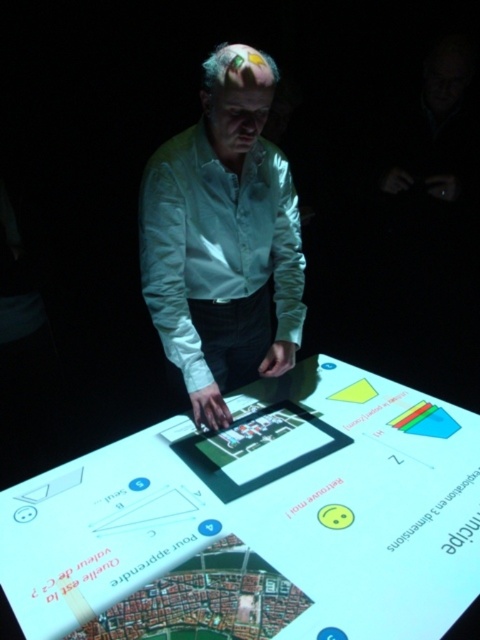
Does point (264, 516) lie in front of point (192, 266)?

Yes.

Find the location of a particular element. translucent glass table at center is located at coordinates (259, 520).